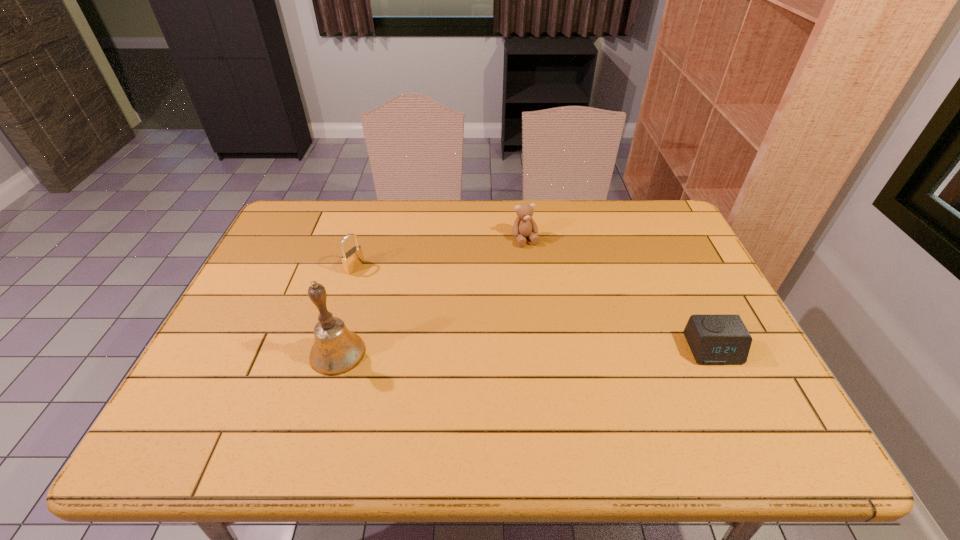
In order to click on free space on the desktop that is between the bell and the shortest object and is positioned on the face of the teddy bear in this screenshot , I will do `click(582, 350)`.

Where is `vacant spot on the desktop that is between the bell and the shortest object and is positioned on the front-facing side of the padlock`? The image size is (960, 540). vacant spot on the desktop that is between the bell and the shortest object and is positioned on the front-facing side of the padlock is located at coordinates (547, 351).